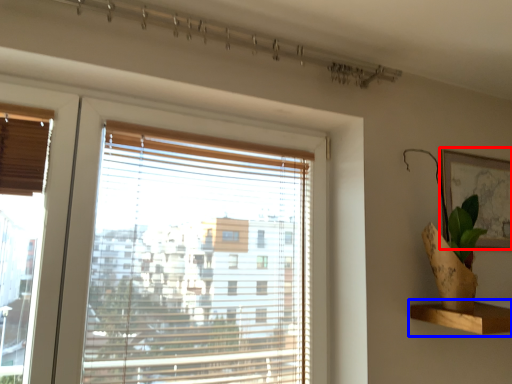
Question: Which point is closer to the camera, picture frame (highlighted by a red box) or shelf (highlighted by a blue box)?

Choices:
 (A) picture frame
 (B) shelf

Answer: (B)